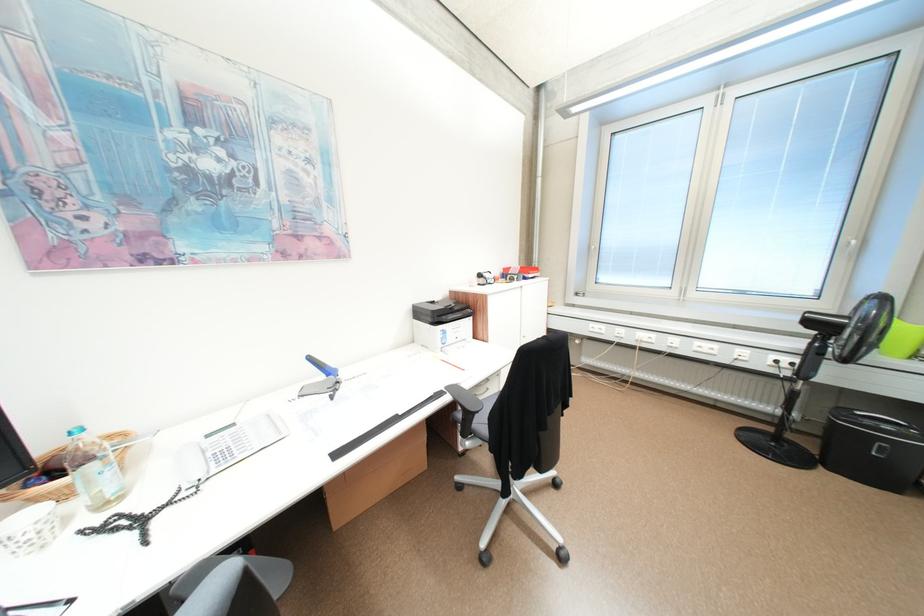
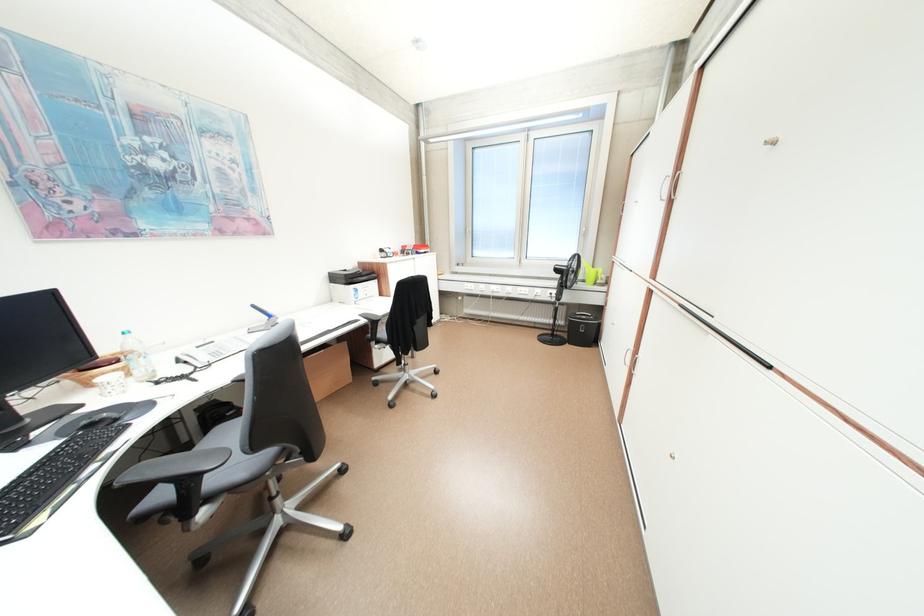
In the second image, find the point that corresponds to (724,346) in the first image.

(537, 290)